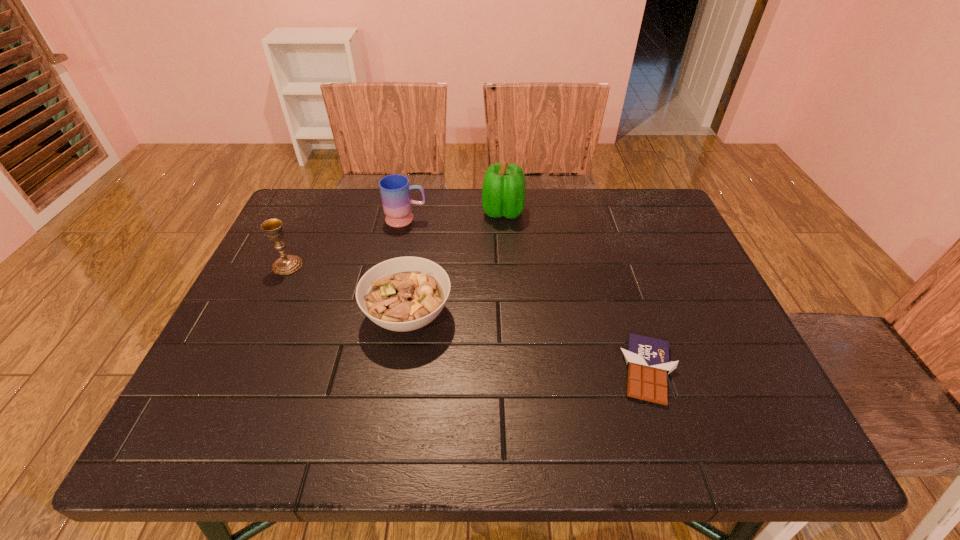
Find the location of a particular element. This screenshot has width=960, height=540. vacant space located 0.080m on the side of the mug with the handle is located at coordinates (x=455, y=219).

Find the location of a particular element. This screenshot has width=960, height=540. free space located on the left of the stew is located at coordinates (313, 315).

Image resolution: width=960 pixels, height=540 pixels. Find the location of `vacant space located on the back of the rightmost object`. vacant space located on the back of the rightmost object is located at coordinates (604, 234).

At what (x,y) coordinates should I click in order to perform the action: click on bell pepper that is at the far edge. Please return your answer as a coordinate pair (x, y). Looking at the image, I should click on (503, 193).

What are the coordinates of `mug that is positioned at the far edge` in the screenshot? It's located at (395, 189).

Find the location of a particular element. object positioned at the left edge is located at coordinates (287, 264).

The image size is (960, 540). Find the location of `object that is at the right edge`. object that is at the right edge is located at coordinates pos(647,358).

Where is `free region at the far edge of the desktop`? The image size is (960, 540). free region at the far edge of the desktop is located at coordinates (359, 195).

Identify the location of vacant position at the near edge of the desktop. (520, 427).

The width and height of the screenshot is (960, 540). Identify the location of free space at the left edge of the desktop. (283, 328).